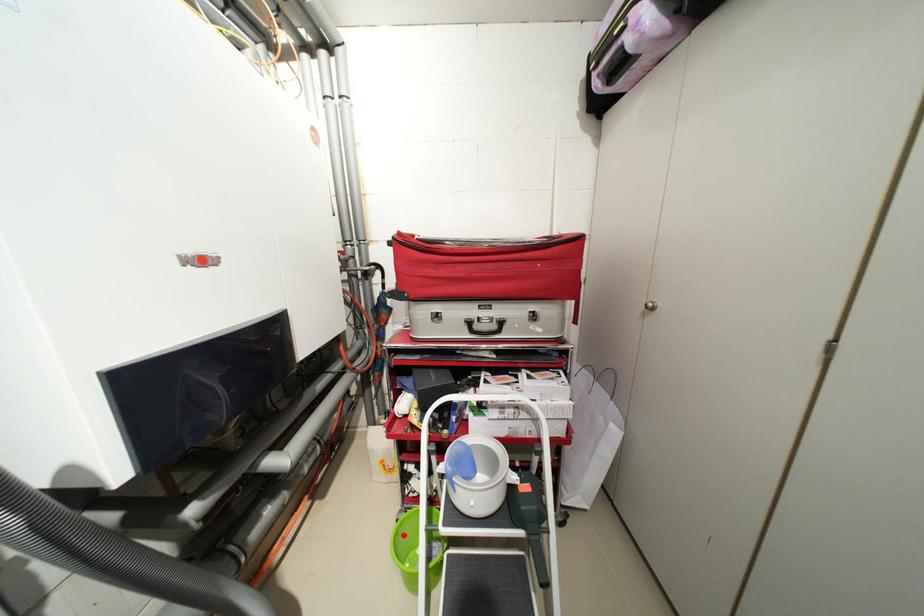
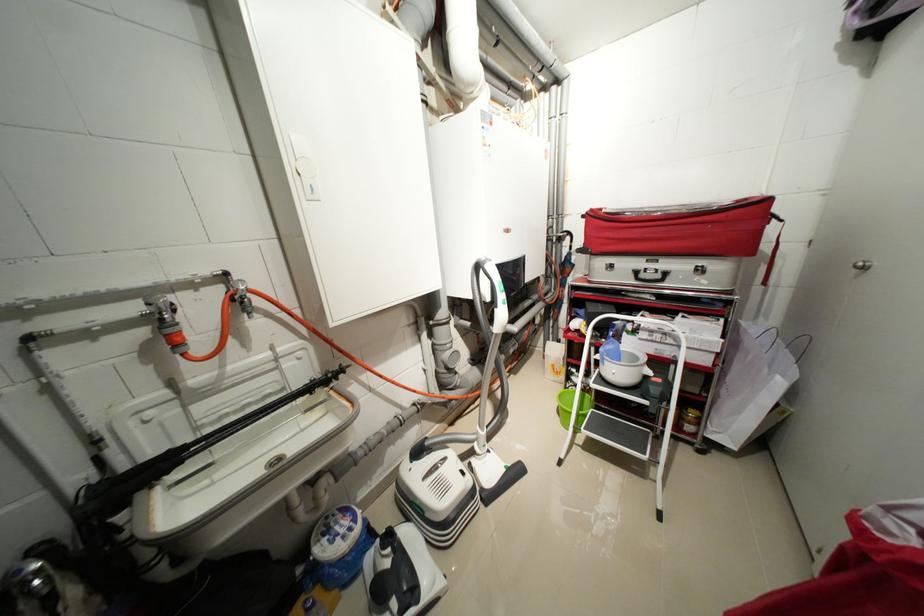
Question: I am providing you with two images of the same scene from different viewpoints. A red point is shown in image1. For the corresponding object point in image2, is it positioned nearer or farther from the camera?

Choices:
 (A) Nearer
 (B) Farther

Answer: (B)